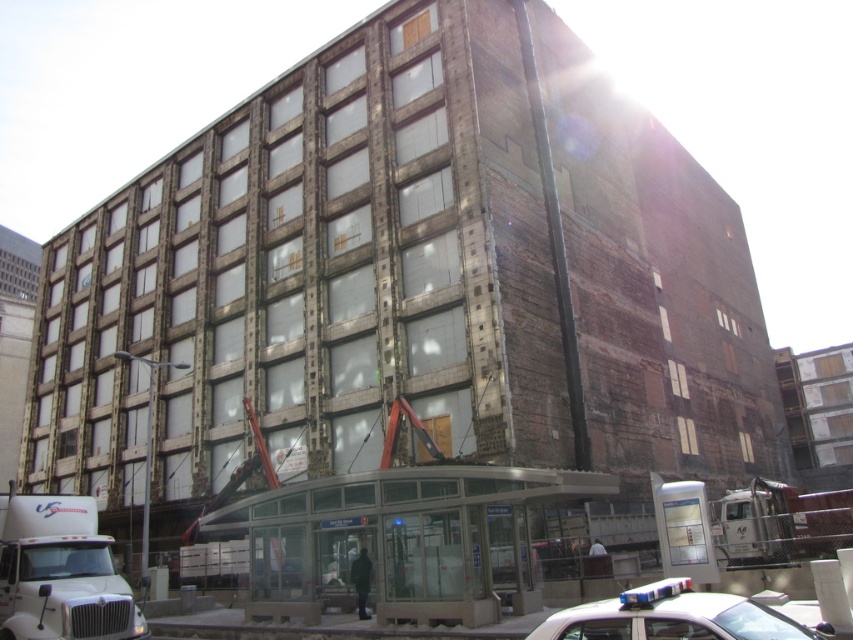
You are standing at the entrance structure in front of the building and want to determine the relative positions of two points marked in the image. Which point, point 1 at coordinates (4, 582) or point 2 at (837, 538), is closer to you?

Point 1 at coordinates (4, 582) is closer to the viewer than point 2 at (837, 538).

You are a delivery driver who needs to park your truck in this area. There are two trucks already present here, the white matte truck at lower left and the white metallic truck at lower right. According to the city regulations, vehicles must be parked at least 20 meters apart for safety. Can you safely park your truck between them?

The white matte truck at lower left and the white metallic truck at lower right are 20.18 meters apart, which meets the city regulation requirement of 20 meters. Therefore, you can safely park your truck between them as the distance between the existing trucks is sufficient.